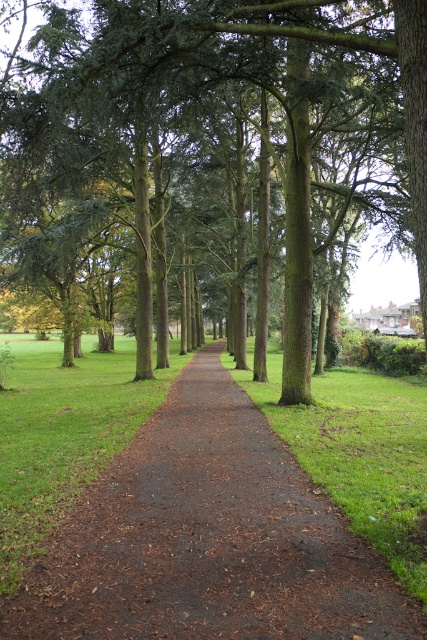
Between green textured tree at center and brown dirt path at center, which one has more height?

green textured tree at center is taller.

Is point (324, 204) positioned in front of point (149, 593)?

No, (324, 204) is further to viewer.

Where is `green textured tree at center`? The width and height of the screenshot is (427, 640). green textured tree at center is located at coordinates [x=210, y=150].